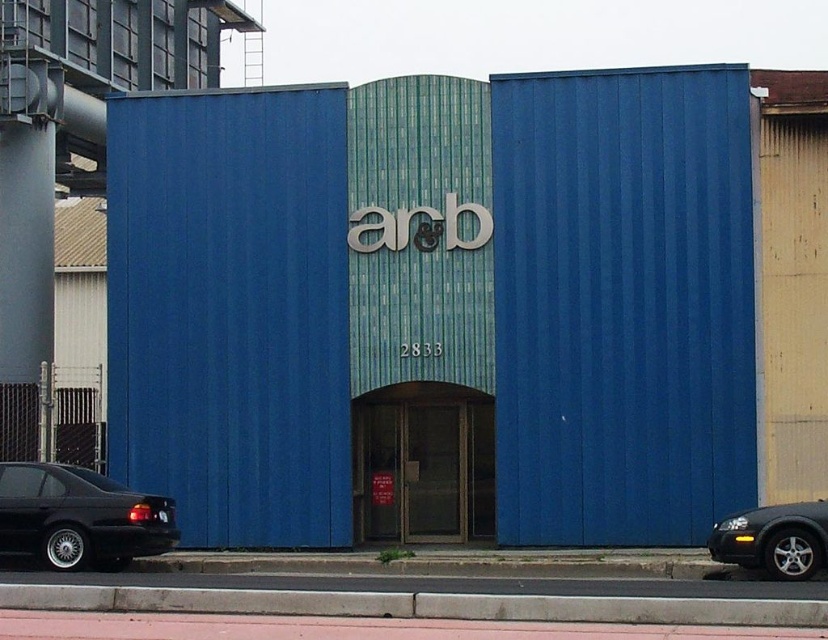
Question: Which point is closer to the camera taking this photo?

Choices:
 (A) (816, 544)
 (B) (47, 465)
 (C) (706, 604)

Answer: (C)

Question: Is pink rubber curb at lower center positioned behind black matte sedan at lower left?

Choices:
 (A) yes
 (B) no

Answer: (B)

Question: Where is pink rubber curb at lower center located in relation to black matte sedan at lower left in the image?

Choices:
 (A) right
 (B) left

Answer: (A)

Question: Which point appears closest to the camera in this image?

Choices:
 (A) (727, 620)
 (B) (788, 515)
 (C) (20, 525)

Answer: (A)

Question: Is pink rubber curb at lower center thinner than black matte sedan at lower left?

Choices:
 (A) no
 (B) yes

Answer: (B)

Question: Which object is closer to the camera taking this photo?

Choices:
 (A) black matte sedan at lower left
 (B) shiny silver sedan at lower right
 (C) pink rubber curb at lower center

Answer: (C)